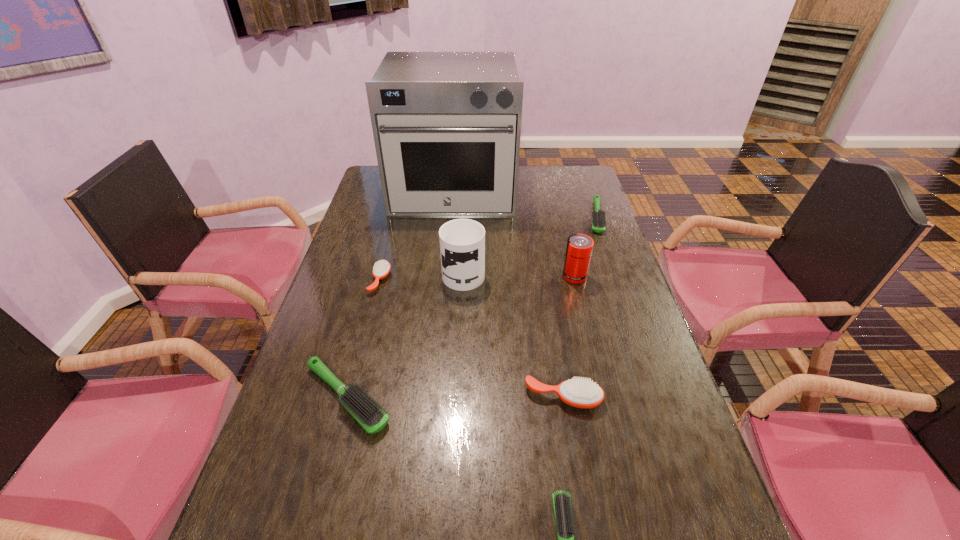
I want to click on empty space between the biggest light hairbrush and the nearer orange hairbrush, so click(x=455, y=397).

Where is `vacant space that is in between the second farthest hairbrush and the leftmost light hairbrush`? This screenshot has height=540, width=960. vacant space that is in between the second farthest hairbrush and the leftmost light hairbrush is located at coordinates (364, 339).

At what (x,y) coordinates should I click in order to perform the action: click on vacant area that lies between the farthest hairbrush and the farther orange hairbrush. Please return your answer as a coordinate pair (x, y). This screenshot has width=960, height=540. Looking at the image, I should click on (489, 249).

The image size is (960, 540). In order to click on vacant region between the farther orange hairbrush and the leftmost light hairbrush in this screenshot , I will do `click(364, 339)`.

The image size is (960, 540). I want to click on free space between the bigger orange hairbrush and the toaster oven, so (x=508, y=294).

Locate which object ranks third in proximity to the nearest object. Please provide its 2D coordinates. Your answer should be formatted as a tuple, i.e. [(x, y)], where the tuple contains the x and y coordinates of a point satisfying the conditions above.

[(462, 241)]

Identify which object is the fourth nearest to the nearer orange hairbrush. Please provide its 2D coordinates. Your answer should be formatted as a tuple, i.e. [(x, y)], where the tuple contains the x and y coordinates of a point satisfying the conditions above.

[(579, 248)]

In order to click on the fourth closest hairbrush to the nearest object in this screenshot , I will do (x=598, y=216).

In order to click on the second closest hairbrush to the nearer orange hairbrush in this screenshot , I will do `click(367, 413)`.

The width and height of the screenshot is (960, 540). What are the coordinates of `the second closest light hairbrush relative to the shortest object` in the screenshot? It's located at (598, 216).